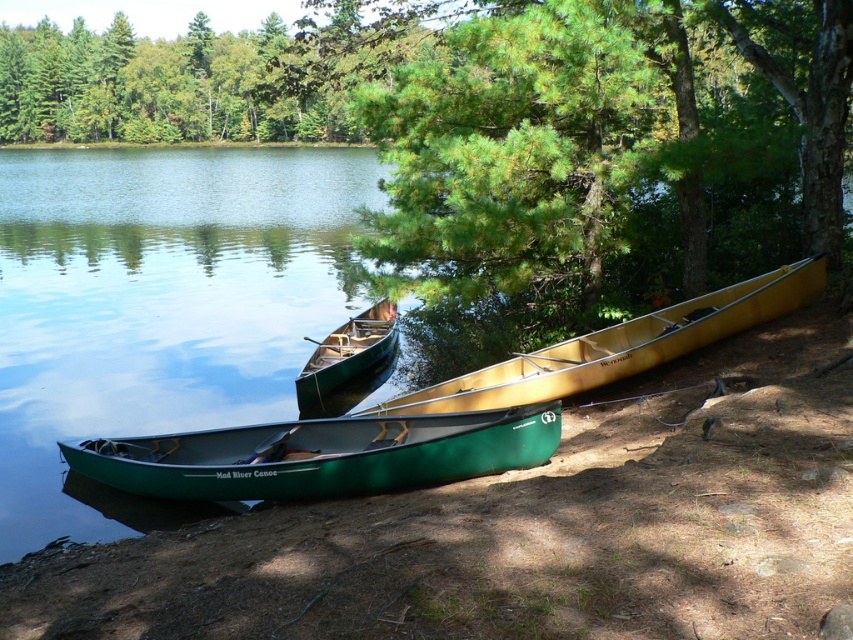
Question: Which point is farther to the camera?

Choices:
 (A) (79, 19)
 (B) (699, 333)

Answer: (A)

Question: Which is farther from the green polished wood canoe at center?

Choices:
 (A) matte yellow canoe at center
 (B) green pine tree at center
 (C) green matte canoe at lower left

Answer: (B)

Question: Considering the relative positions of green pine tree at center and matte yellow canoe at center in the image provided, where is green pine tree at center located with respect to matte yellow canoe at center?

Choices:
 (A) right
 (B) left

Answer: (B)

Question: Which of the following is the farthest from the observer?

Choices:
 (A) green polished wood canoe at center
 (B) green pine tree at center

Answer: (A)

Question: Does green leafy trees at upper center come behind green polished wood canoe at center?

Choices:
 (A) no
 (B) yes

Answer: (A)

Question: Is matte yellow canoe at center below green polished wood canoe at center?

Choices:
 (A) no
 (B) yes

Answer: (B)